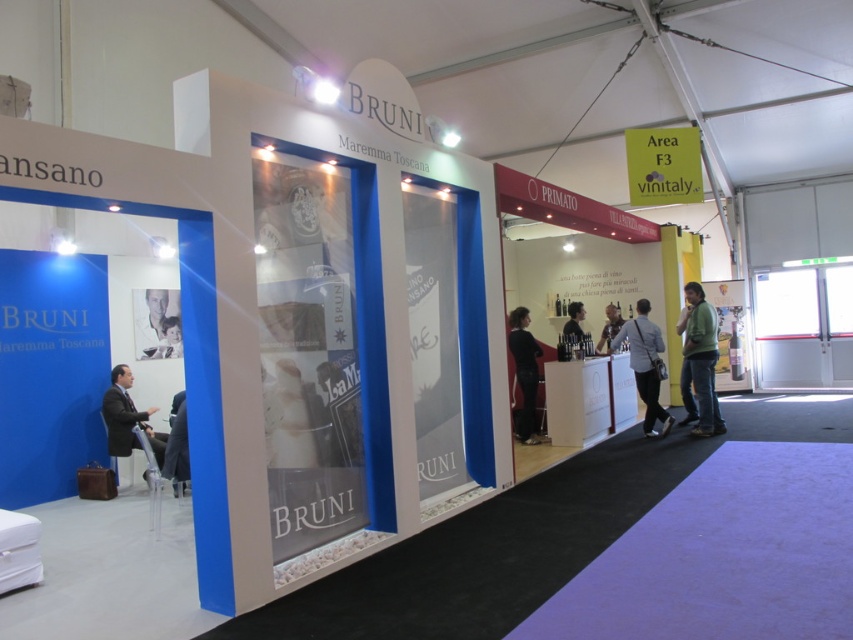
From the picture: You are a photographer setting up a shoot inside the Bruni booth. You need to position a light source so that it illuminates both the green matte jacket at lower right and the black fabric at center without casting shadows on the wine bottles displayed behind them. Given their heights, which object should be placed closer to the light source to ensure proper illumination?

The green matte jacket at lower right is taller than the black fabric at center. To avoid shadows on the wine bottles behind, the taller green matte jacket at lower right should be positioned closer to the light source so that its shadow doesn

You are a fashion buyer at a store and you see two jackets in the image, a light gray fabric jacket at center and a light brown leather jacket at center. Which jacket is positioned to the right of the other?

The light gray fabric jacket at center is positioned to the right of the light brown leather jacket at center.